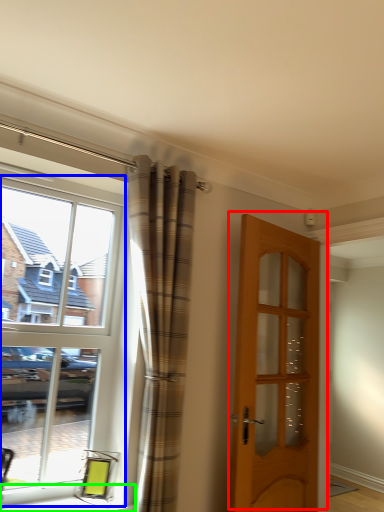
Question: Which object is positioned closest to door (highlighted by a red box)? Select from window (highlighted by a blue box) and window sill (highlighted by a green box).

Choices:
 (A) window
 (B) window sill

Answer: (A)